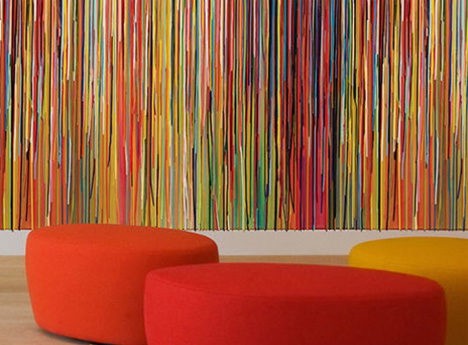
Where is `floor`? This screenshot has width=468, height=345. floor is located at coordinates (15, 326).